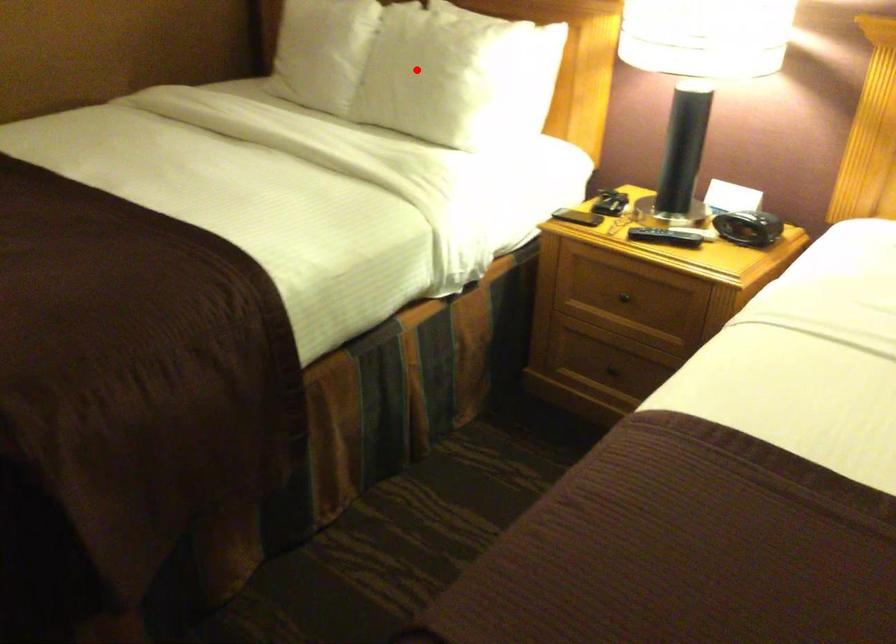
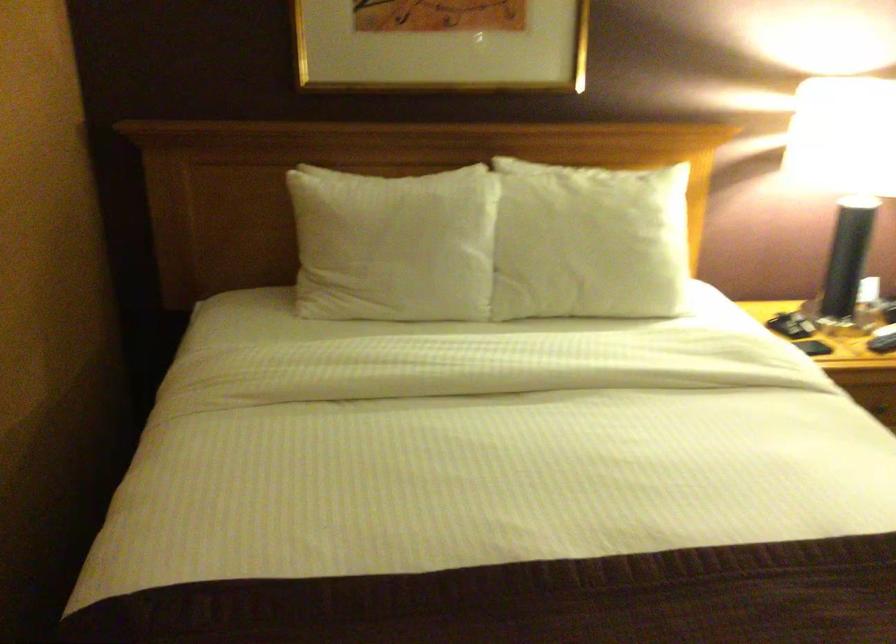
Find the pixel in the second image that matches the highlighted location in the first image.

(589, 242)